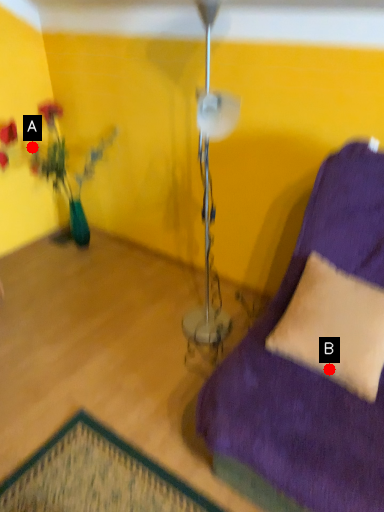
Question: Two points are circled on the image, labeled by A and B beside each circle. Which point appears closest to the camera in this image?

Choices:
 (A) A is closer
 (B) B is closer

Answer: (B)